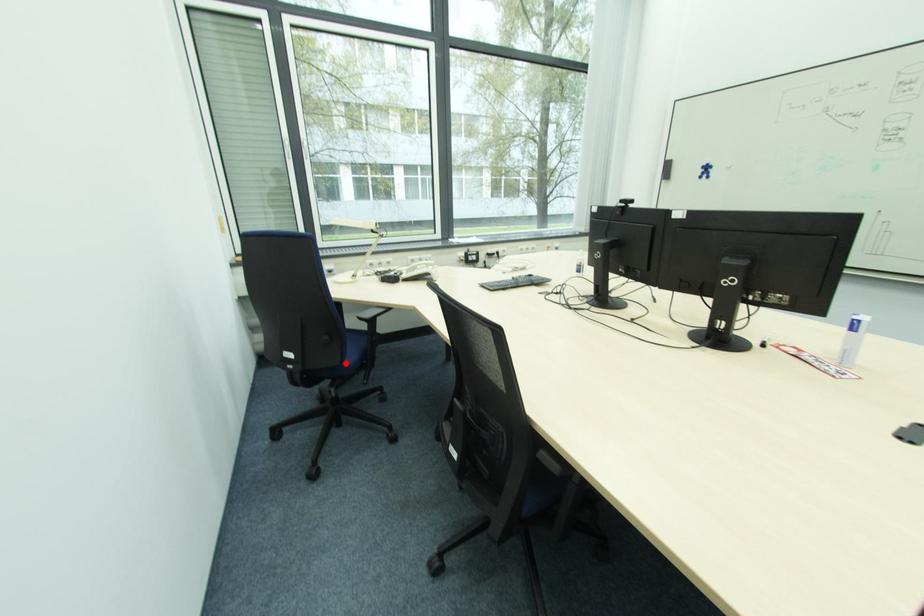
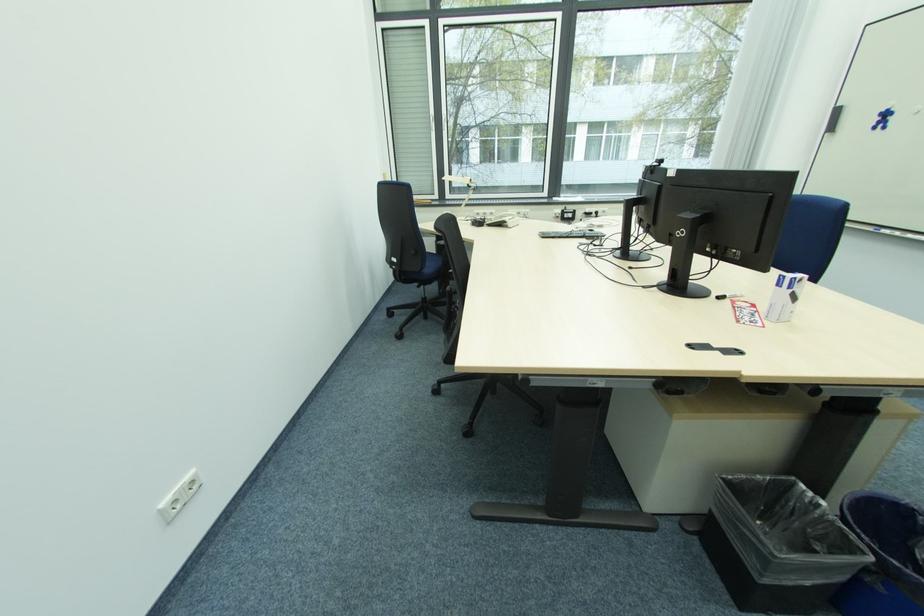
Where in the second image is the point corresponding to the highlighted location from the first image?

(427, 272)